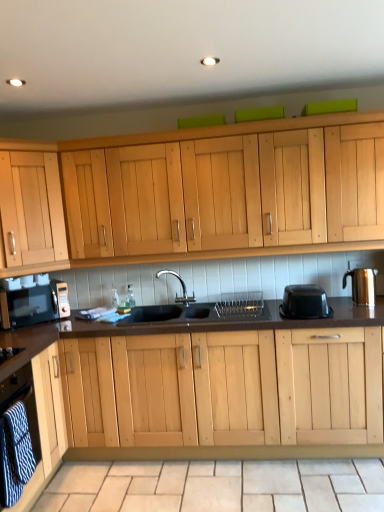
You are a GUI agent. You are given a task and a screenshot of the screen. Output one action in this format:
    pyautogui.click(x=<x>, y=<y>)
    Task: Click on the blank space above beige tile at lower center (from a real-world perspective)
    
    Given the screenshot: What is the action you would take?
    pyautogui.click(x=209, y=480)